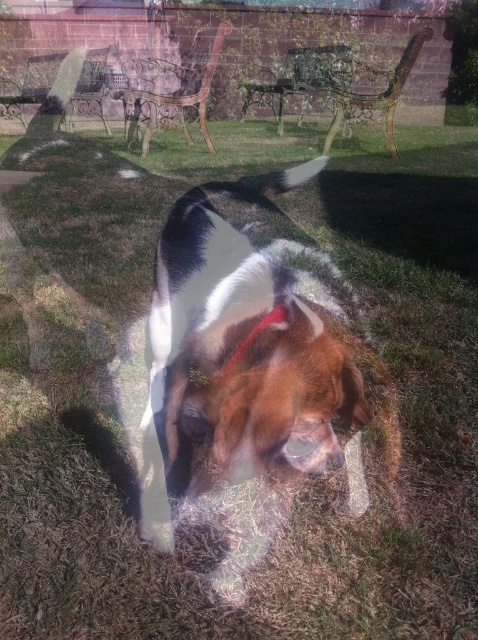
You are standing in the garden and see two points marked in the image. Which point, point (241, 282) or point (269, 314), is closer to you?

Point (241, 282) is closer to you because it is further to the viewer than point (269, 314).

You are a photographer taking a picture of the brown and white fur dog at center and the red fabric neckband at center. Based on their positions, which object is closer to the camera?

The brown and white fur dog at center is closer to the camera because it is located above the red fabric neckband at center, indicating it is in a forward position.

You are a photographer trying to capture a closeup of the red fabric neckband at center. Given that the brown and white fur dog at center is blocking the view, can you estimate if the neckband is visible without moving the dog?

The brown and white fur dog at center is much taller as red fabric neckband at center, so the neckband might be partially or fully hidden by the dog. Moving the dog or adjusting the angle might be necessary to get a clear view.